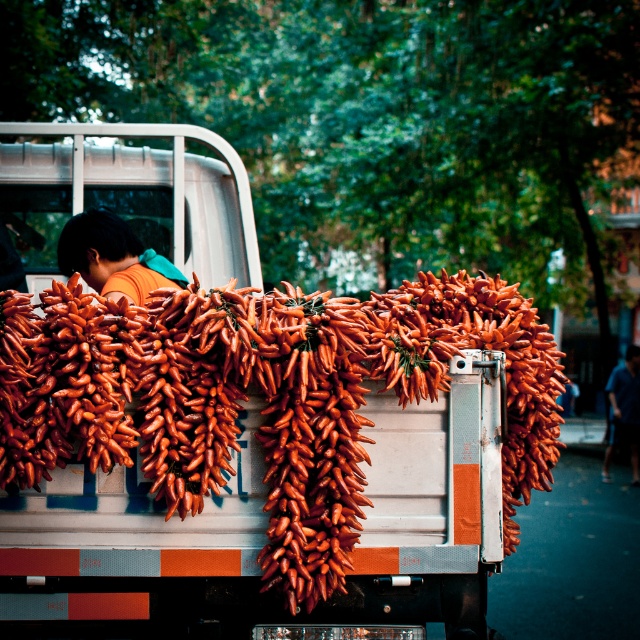
You are a customer at a market and see two shirts displayed on a rack in front of you. The orange matte shirt at center and the blue fabric shirt at right. Which shirt is positioned more to the left?

The orange matte shirt at center is positioned more to the left than the blue fabric shirt at right.